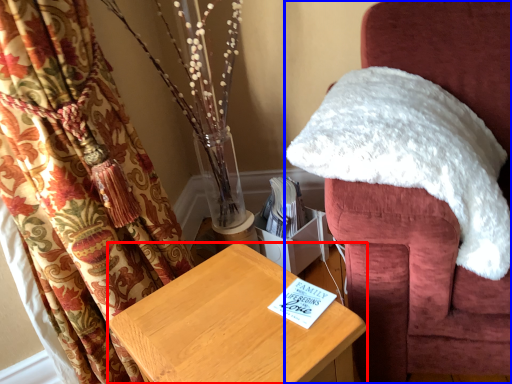
Question: Which object appears farthest to the camera in this image, furniture (highlighted by a red box) or chair (highlighted by a blue box)?

Choices:
 (A) furniture
 (B) chair

Answer: (B)